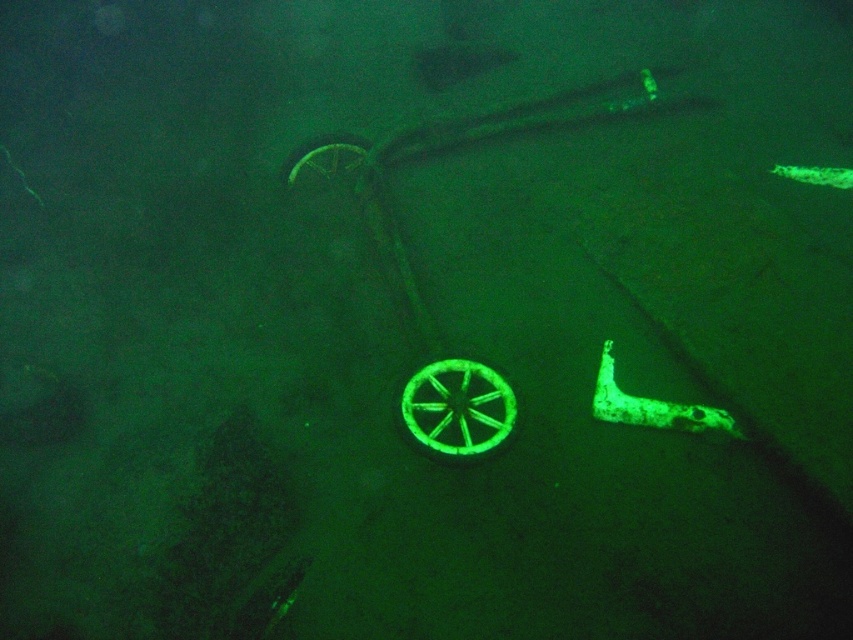
Question: Which of the following is the farthest from the observer?

Choices:
 (A) green matte wheel at upper center
 (B) green matte wheel at center

Answer: (A)

Question: Is green matte wheel at center bigger than green matte wheel at upper center?

Choices:
 (A) no
 (B) yes

Answer: (B)

Question: Which point is farther to the camera?

Choices:
 (A) green matte wheel at center
 (B) green matte wheel at upper center

Answer: (B)

Question: Which point appears closest to the camera in this image?

Choices:
 (A) (431, 440)
 (B) (314, 148)

Answer: (A)

Question: Is green matte wheel at center above green matte wheel at upper center?

Choices:
 (A) yes
 (B) no

Answer: (B)

Question: Is green matte wheel at center in front of green matte wheel at upper center?

Choices:
 (A) no
 (B) yes

Answer: (B)